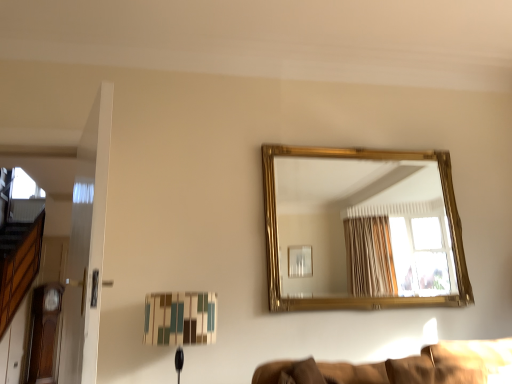
Question: From the image's perspective, is matte plastic table lamp at lower center located beneath brown fabric couch at lower right?

Choices:
 (A) no
 (B) yes

Answer: (A)

Question: Is matte plastic table lamp at lower center outside of brown fabric couch at lower right?

Choices:
 (A) no
 (B) yes

Answer: (B)

Question: Is matte plastic table lamp at lower center in front of brown fabric couch at lower right?

Choices:
 (A) yes
 (B) no

Answer: (B)

Question: Does matte plastic table lamp at lower center appear on the right side of brown fabric couch at lower right?

Choices:
 (A) yes
 (B) no

Answer: (B)

Question: Is matte plastic table lamp at lower center oriented towards brown fabric couch at lower right?

Choices:
 (A) yes
 (B) no

Answer: (B)

Question: Is point (509, 339) closer or farther from the camera than point (158, 319)?

Choices:
 (A) closer
 (B) farther

Answer: (B)

Question: Is brown fabric couch at lower right to the left or to the right of matte plastic table lamp at lower center in the image?

Choices:
 (A) left
 (B) right

Answer: (B)

Question: In terms of size, does brown fabric couch at lower right appear bigger or smaller than matte plastic table lamp at lower center?

Choices:
 (A) small
 (B) big

Answer: (A)

Question: In terms of height, does brown fabric couch at lower right look taller or shorter compared to matte plastic table lamp at lower center?

Choices:
 (A) short
 (B) tall

Answer: (A)

Question: From the image's perspective, is brown fabric couch at lower right positioned above or below gold/gilded mirror at upper center?

Choices:
 (A) below
 (B) above

Answer: (A)

Question: Considering the relative positions of brown fabric couch at lower right and gold/gilded mirror at upper center in the image provided, is brown fabric couch at lower right to the left or to the right of gold/gilded mirror at upper center?

Choices:
 (A) right
 (B) left

Answer: (B)

Question: Considering the positions of brown fabric couch at lower right and gold/gilded mirror at upper center in the image, is brown fabric couch at lower right taller or shorter than gold/gilded mirror at upper center?

Choices:
 (A) short
 (B) tall

Answer: (A)

Question: Is point (416, 377) closer or farther from the camera than point (410, 226)?

Choices:
 (A) closer
 (B) farther

Answer: (A)

Question: Considering the relative positions of matte plastic table lamp at lower center and gold/gilded mirror at upper center in the image provided, is matte plastic table lamp at lower center to the left or to the right of gold/gilded mirror at upper center?

Choices:
 (A) left
 (B) right

Answer: (A)

Question: Is point (142, 337) positioned closer to the camera than point (311, 203)?

Choices:
 (A) closer
 (B) farther

Answer: (A)